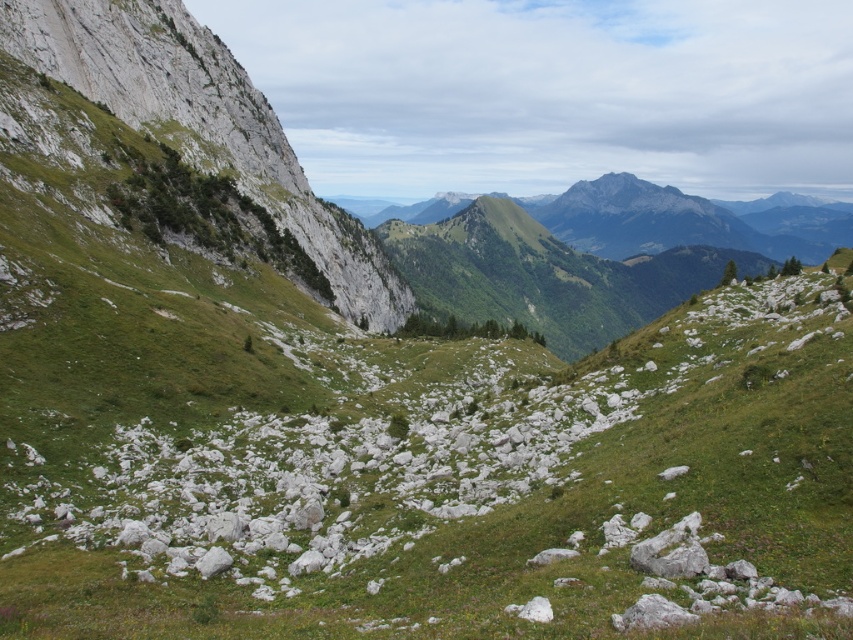
You are a hiker planning to set up a tent on the green grassy at center. Based on the scene description, what coordinates should you look for to place your tent?

The green grassy at center is located at coordinates point (450, 484), so you should look for that point to place your tent.

In the scene shown: You are a hiker planning to cross from the green grassy slope at left to the green grassy at center. Which direction should you move to reach your destination?

You should move to the right to reach the green grassy at center from the green grassy slope at left, as it is located to the right of it.